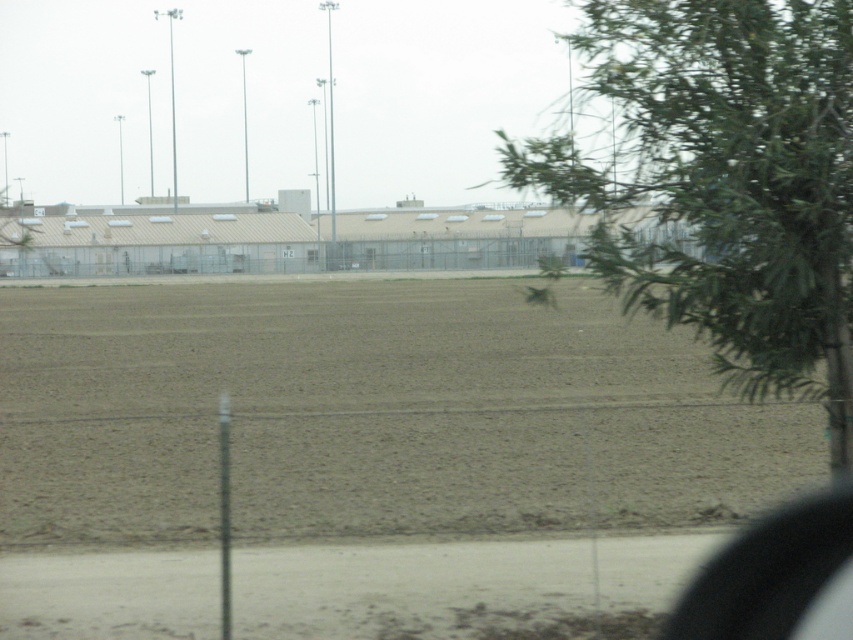
You are planning to plant a row of shrubs along the edge of the brown soil at center. Considering the space available, will the green leafy tree at upper right interfere with the shrubs if they grow to the same width as the tree?

The brown soil at center is wider than the green leafy tree at upper right, so planting shrubs there should not be interfered by the tree.

You are a delivery driver who needs to park your car so that the transparent glass car window at lower right faces away from the brown soil at center. Given their size difference, which object should you position closer to the edge of the facility to ensure proper alignment?

Since the brown soil at center is larger than the transparent glass car window at lower right, you should position the transparent glass car window at lower right closer to the edge of the facility. This way, the smaller window can be aligned away from the larger soil area more effectively.